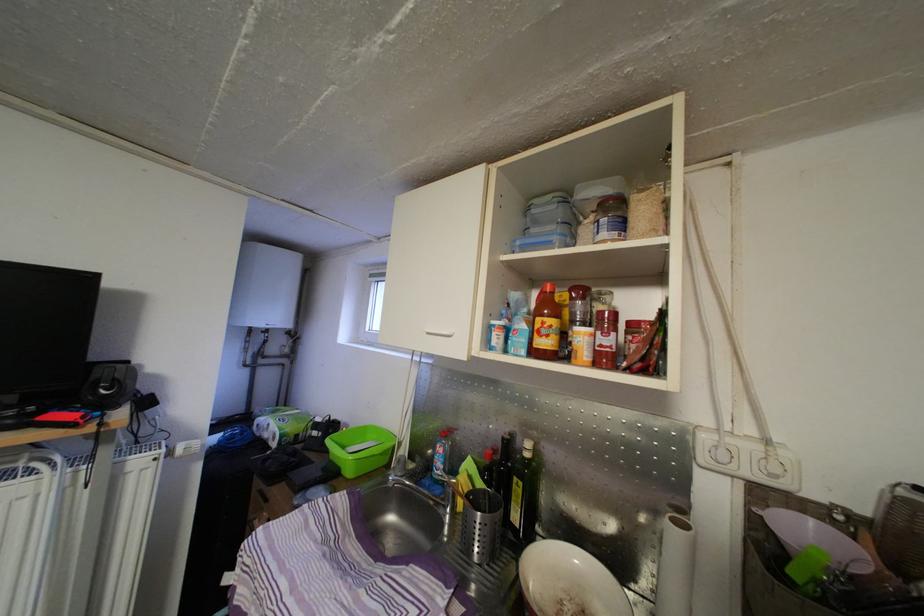
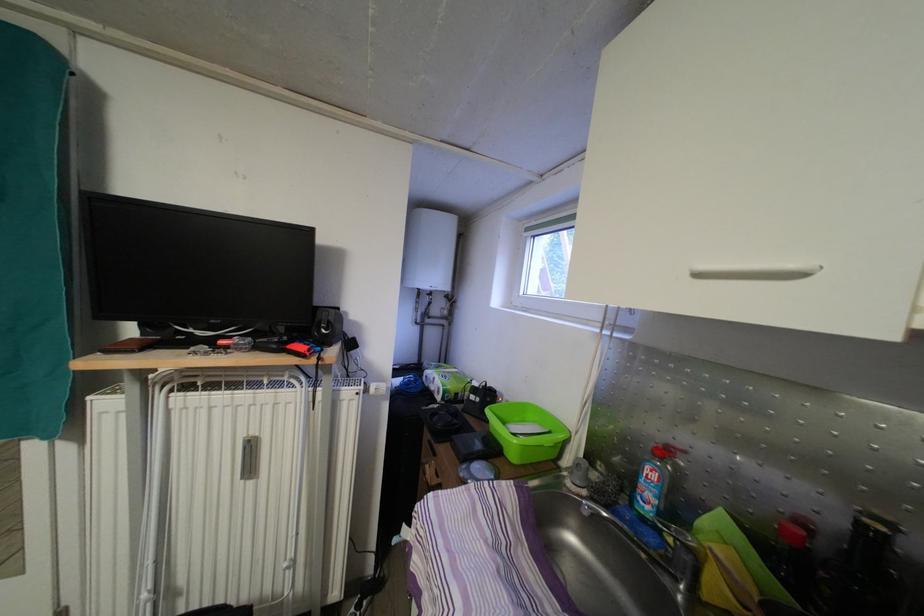
Question: I am providing you with two images of the same scene from different viewpoints. After the viewpoint changes to image2, which objects are now occluded?

Choices:
 (A) blue soap bottle
 (B) black computer speaker
 (C) white radiator knob
 (D) none of these

Answer: (D)